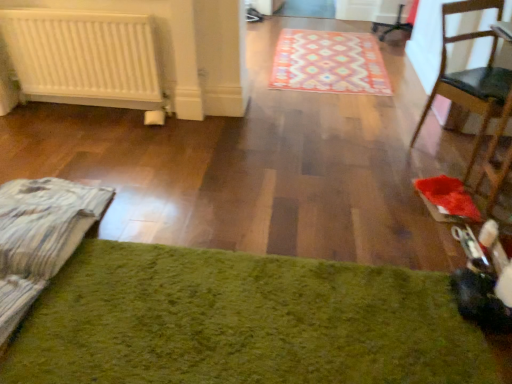
What are the coordinates of `vacant space to the right of white matte radiator at left` in the screenshot? It's located at (182, 130).